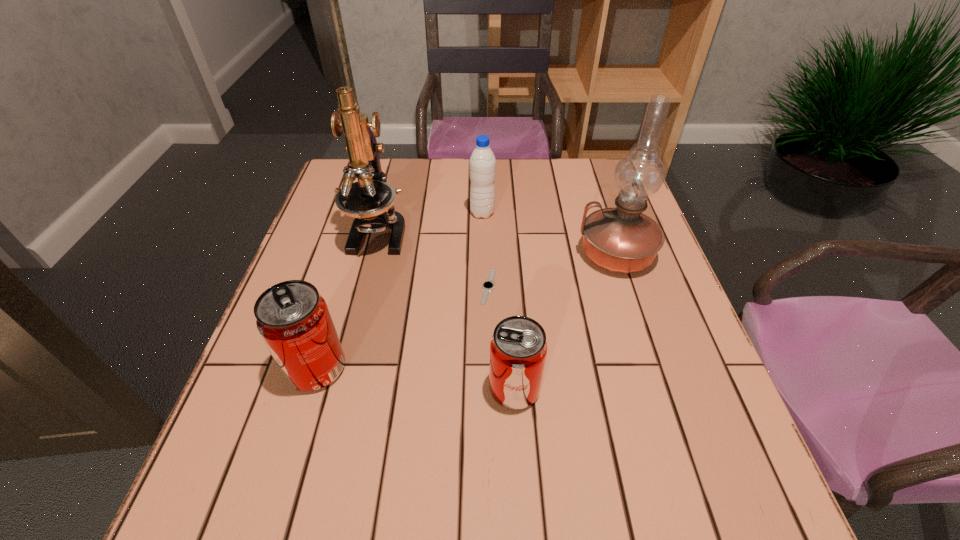
You are a GUI agent. You are given a task and a screenshot of the screen. Output one action in this format:
    pyautogui.click(x=<x>, y=<y>)
    Task: Click on the unoccupied area between the shortest object and the rightmost object
    This screenshot has width=960, height=540.
    Given the screenshot: What is the action you would take?
    coord(552,271)

In order to click on free space between the left pop soda and the microscope in this screenshot , I will do `click(348, 300)`.

Find the location of `empty space that is in between the rightmost object and the fourth tallest object`. empty space that is in between the rightmost object and the fourth tallest object is located at coordinates (466, 311).

Locate an element on the screen. the second closest object to the water bottle is located at coordinates (488, 285).

Identify which object is the third nearest to the taller pop soda. Please provide its 2D coordinates. Your answer should be formatted as a tuple, i.e. [(x, y)], where the tuple contains the x and y coordinates of a point satisfying the conditions above.

[(488, 285)]

At what (x,y) coordinates should I click in order to perform the action: click on free location that satisfies the following two spatial constraints: 1. at the eyepiece of the shortest object; 2. on the right side of the microscope. Please return your answer as a coordinate pair (x, y). Looking at the image, I should click on [x=365, y=287].

Where is `vacant point that satisfies the following two spatial constraints: 1. on the front side of the oil lamp; 2. on the right side of the water bottle`? The height and width of the screenshot is (540, 960). vacant point that satisfies the following two spatial constraints: 1. on the front side of the oil lamp; 2. on the right side of the water bottle is located at coordinates (483, 254).